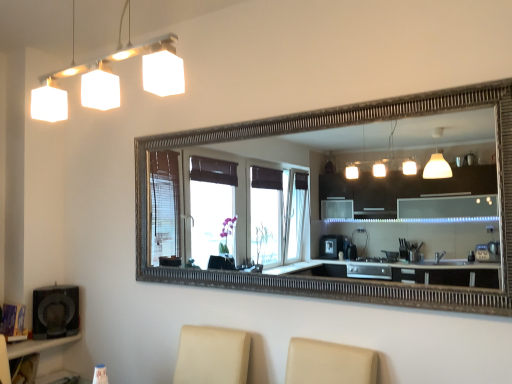
The image size is (512, 384). In order to click on matte black speaker at lower left in this screenshot , I will do `click(55, 312)`.

Measure the distance between point (32,340) and camera.

Point (32,340) and camera are 7.96 feet apart from each other.

This screenshot has width=512, height=384. What do you see at coordinates (35, 346) in the screenshot?
I see `matte black shelf at lower left` at bounding box center [35, 346].

Where is `matte black speaker at lower left`? Image resolution: width=512 pixels, height=384 pixels. matte black speaker at lower left is located at coordinates (55, 312).

Looking at their sizes, would you say matte black shelf at lower left is wider or thinner than matte black speaker at lower left?

Considering their sizes, matte black shelf at lower left looks slimmer than matte black speaker at lower left.

Would you say matte black shelf at lower left is inside or outside matte black speaker at lower left?

matte black shelf at lower left is not inside matte black speaker at lower left, it's outside.

Who is more distant, matte black shelf at lower left or matte black speaker at lower left?

matte black speaker at lower left is more distant.

Is matte black shelf at lower left located outside white matte square light fixture at upper left?

Indeed, matte black shelf at lower left is completely outside white matte square light fixture at upper left.

Does point (14, 347) come behind point (118, 76)?

No, it is in front of (118, 76).

Could you tell me if matte black shelf at lower left is facing white matte square light fixture at upper left?

No, matte black shelf at lower left does not turn towards white matte square light fixture at upper left.

In the image, is white matte square light fixture at upper left positioned in front of or behind matte black speaker at lower left?

Visually, white matte square light fixture at upper left is located in front of matte black speaker at lower left.

Is white matte square light fixture at upper left to the left of matte black speaker at lower left from the viewer's perspective?

No.

Which of these two, white matte square light fixture at upper left or matte black speaker at lower left, stands taller?

white matte square light fixture at upper left.

Would you say white matte square light fixture at upper left is a long distance from matte black speaker at lower left?

Yes, white matte square light fixture at upper left and matte black speaker at lower left are located far from each other.

Can white matte square light fixture at upper left be found inside matte black speaker at lower left?

Definitely not — white matte square light fixture at upper left is not inside matte black speaker at lower left.

From a real-world perspective, is matte black speaker at lower left below white matte square light fixture at upper left?

Yes, from a real-world perspective, matte black speaker at lower left is beneath white matte square light fixture at upper left.

Could you tell me if matte black speaker at lower left is facing white matte square light fixture at upper left?

No, matte black speaker at lower left is not facing towards white matte square light fixture at upper left.

Based on the photo, who is smaller, matte black speaker at lower left or white matte square light fixture at upper left?

With smaller size is white matte square light fixture at upper left.

How far apart are matte black speaker at lower left and matte black shelf at lower left?

matte black speaker at lower left is 4.77 inches away from matte black shelf at lower left.

Could you tell me if matte black speaker at lower left is turned towards matte black shelf at lower left?

No, matte black speaker at lower left is not facing towards matte black shelf at lower left.

Is matte black speaker at lower left far from matte black shelf at lower left?

They are positioned close to each other.

Can you confirm if white matte square light fixture at upper left is bigger than matte black shelf at lower left?

No, white matte square light fixture at upper left is not bigger than matte black shelf at lower left.

From a real-world perspective, who is located higher, white matte square light fixture at upper left or matte black shelf at lower left?

white matte square light fixture at upper left, from a real-world perspective.

Does white matte square light fixture at upper left have a lesser height compared to matte black shelf at lower left?

Correct, white matte square light fixture at upper left is not as tall as matte black shelf at lower left.

Based on the photo, is white matte square light fixture at upper left oriented away from matte black shelf at lower left?

white matte square light fixture at upper left does not have its back to matte black shelf at lower left.

Identify the location of vanity beneath the matte black speaker at lower left (from a real-world perspective). The width and height of the screenshot is (512, 384). (35, 346).

You are a GUI agent. You are given a task and a screenshot of the screen. Output one action in this format:
    pyautogui.click(x=<x>, y=<y>)
    Task: Click on the lamp in front of the matte black shelf at lower left
    This screenshot has height=384, width=512.
    Given the screenshot: What is the action you would take?
    pyautogui.click(x=111, y=77)

From the picture: Considering their positions, is white matte square light fixture at upper left positioned closer to matte black shelf at lower left than matte black speaker at lower left?

matte black speaker at lower left lies closer to matte black shelf at lower left than the other object.

From the image, which object appears to be nearer to matte black speaker at lower left, matte black shelf at lower left or white matte square light fixture at upper left?

matte black shelf at lower left.

In the scene shown: From the image, which object appears to be farther from matte black shelf at lower left, matte black speaker at lower left or white matte square light fixture at upper left?

The object further to matte black shelf at lower left is white matte square light fixture at upper left.

Which object lies further to the anchor point white matte square light fixture at upper left, matte black shelf at lower left or matte black speaker at lower left?

matte black shelf at lower left.

Based on their spatial positions, is matte black speaker at lower left or matte black shelf at lower left further from white matte square light fixture at upper left?

Among the two, matte black shelf at lower left is located further to white matte square light fixture at upper left.

Considering their positions, is white matte square light fixture at upper left positioned further to matte black speaker at lower left than matte black shelf at lower left?

white matte square light fixture at upper left is further to matte black speaker at lower left.

I want to click on vanity between white matte square light fixture at upper left and matte black speaker at lower left from front to back, so click(35, 346).